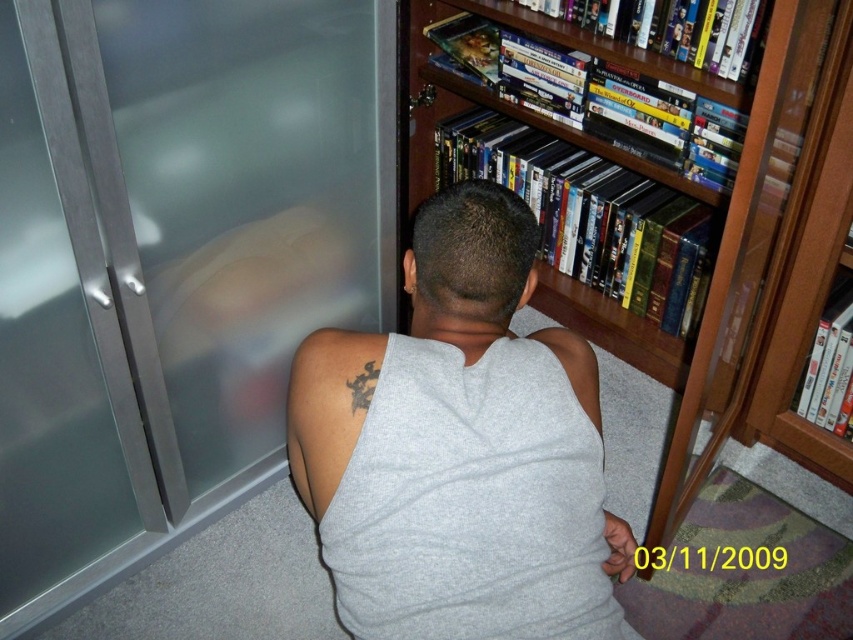
Is wooden bookshelf at upper right smaller than black ink tattoo at upper back?

Actually, wooden bookshelf at upper right might be larger than black ink tattoo at upper back.

Is wooden bookshelf at upper right closer to the viewer compared to black ink tattoo at upper back?

Yes, wooden bookshelf at upper right is closer to the viewer.

Between point (709, 296) and point (351, 390), which one is positioned behind?

The point (709, 296) is behind.

Identify the location of wooden bookshelf at upper right. (752, 243).

Consider the image. Which is more to the right, frosted glass door at left or gray cotton tank top at center?

gray cotton tank top at center

Between point (231, 474) and point (444, 531), which one is positioned behind?

Positioned behind is point (231, 474).

Where is `frosted glass door at left`? This screenshot has width=853, height=640. frosted glass door at left is located at coordinates (172, 260).

The width and height of the screenshot is (853, 640). Identify the location of frosted glass door at left. (172, 260).

Can you confirm if frosted glass door at left is positioned to the right of black ink tattoo at upper back?

Incorrect, frosted glass door at left is not on the right side of black ink tattoo at upper back.

How far apart are frosted glass door at left and black ink tattoo at upper back?

frosted glass door at left and black ink tattoo at upper back are 24.60 inches apart from each other.

Describe the element at coordinates (172, 260) in the screenshot. I see `frosted glass door at left` at that location.

This screenshot has height=640, width=853. What are the coordinates of `frosted glass door at left` in the screenshot? It's located at (172, 260).